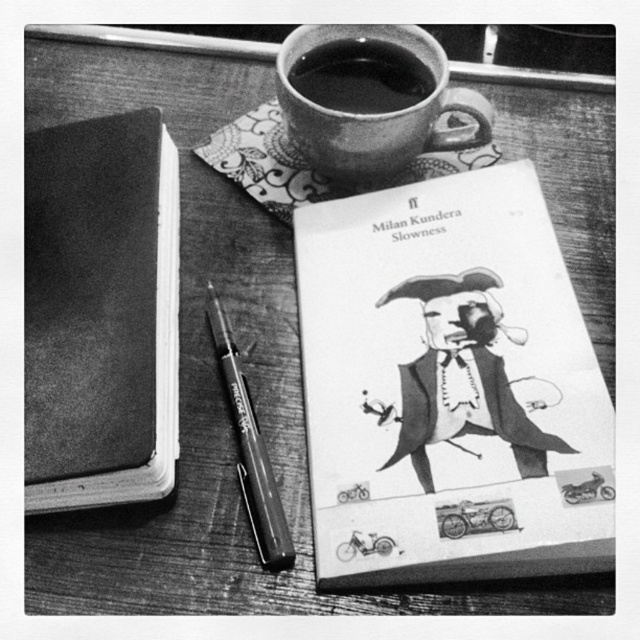
You are an author who wants to place a new manuscript between the paperback book at center and the smooth matte notebook at left. Based on their positions, where should you place the manuscript?

The paperback book at center is located below the smooth matte notebook at left, so you should place the manuscript between them by positioning it above the paperback book at center and below the smooth matte notebook at left.

You are a writer who wants to reach the smooth matte notebook at left from your current position. The notebook is placed on a desk. Can you comfortably reach it without moving your chair?

The smooth matte notebook at left is 14.28 inches away from the viewer, which is a comfortable distance to reach without moving the chair.

You are an author working on a novel and need to decide where to place your PRECOSE pen. You have two options on your desk in the image. Which object is closer to you, the smooth matte notebook at left or the matte ceramic mug at upper center?

The smooth matte notebook at left is closer to you because it is in front of the matte ceramic mug at upper center.